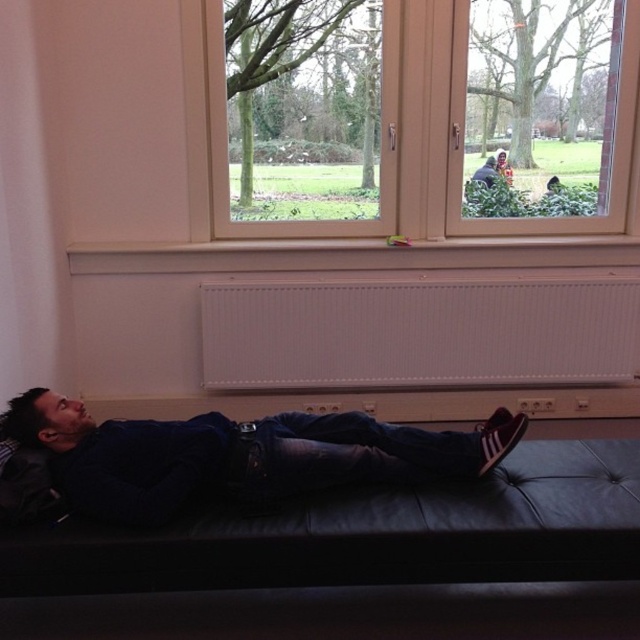
In the scene shown: Who is positioned more to the right, black leather couch at lower center or wooden frame window at upper center?

Positioned to the right is wooden frame window at upper center.

Which is behind, point (268, 589) or point (448, 4)?

The point (448, 4) is more distant.

Where is `black leather couch at lower center`? The image size is (640, 640). black leather couch at lower center is located at coordinates (358, 563).

Looking at this image, is wooden frame window at upper center closer to camera compared to dark blue leather jacket at lower center?

No, wooden frame window at upper center is further to the viewer.

Where is `wooden frame window at upper center`? wooden frame window at upper center is located at coordinates (385, 172).

Is the position of black leather couch at lower center less distant than that of dark blue leather jacket at lower center?

Yes, black leather couch at lower center is in front of dark blue leather jacket at lower center.

Is black leather couch at lower center taller than dark blue leather jacket at lower center?

Yes, black leather couch at lower center is taller than dark blue leather jacket at lower center.

This screenshot has height=640, width=640. Identify the location of black leather couch at lower center. (358, 563).